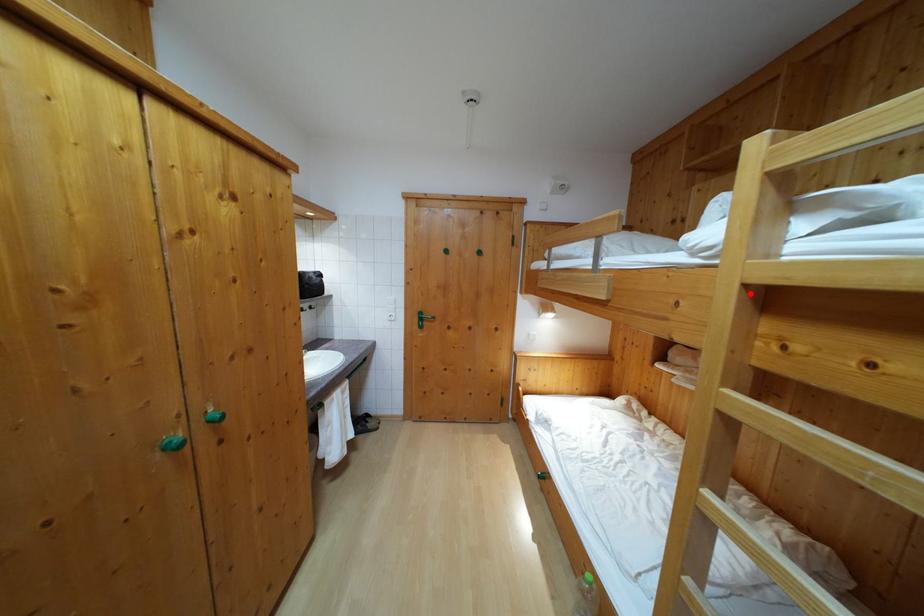
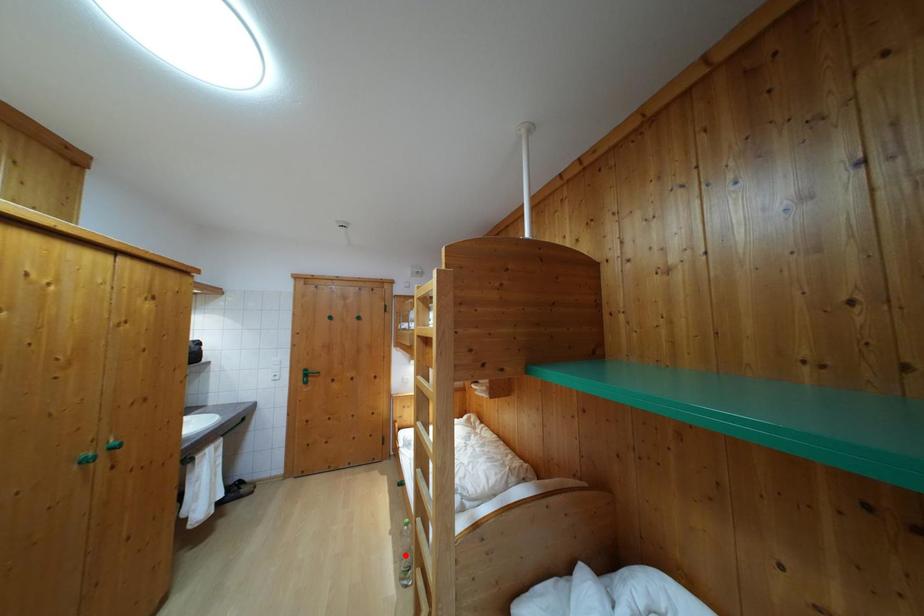
I am providing you with two images of the same scene from different viewpoints. A red point is marked on the first image and another point is marked on the second image. Is the red point in image1 aligned with the point shown in image2?

No